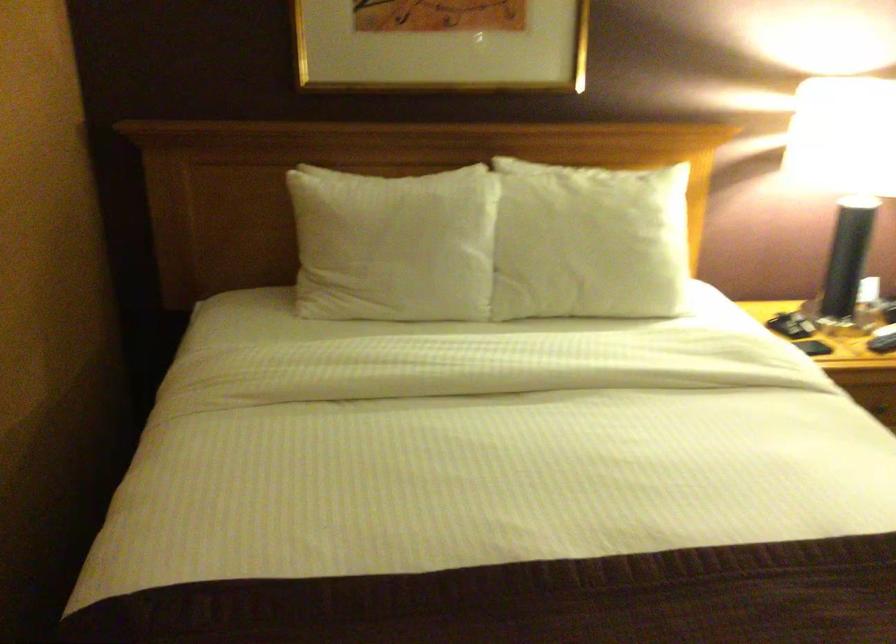
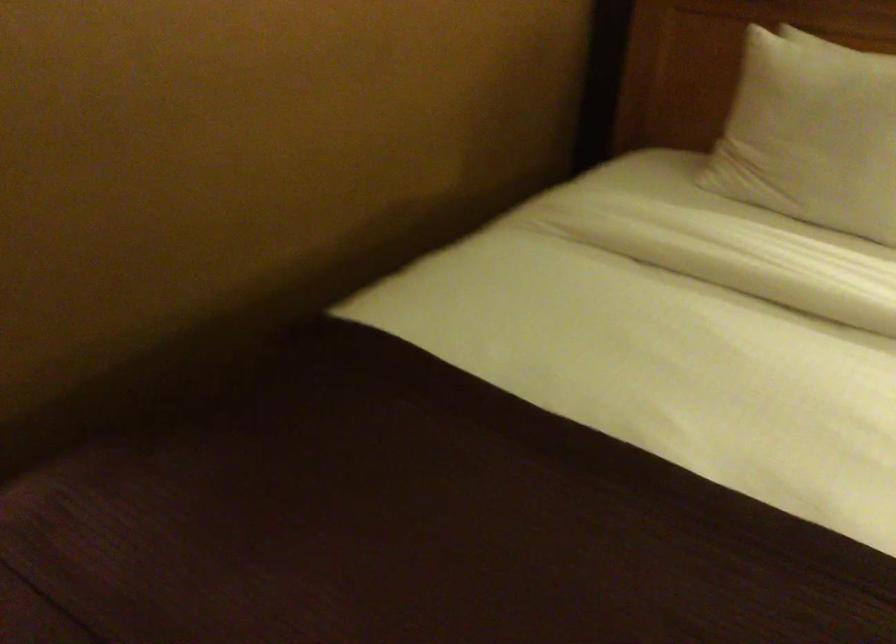
Question: The camera is either moving clockwise (left) or counter-clockwise (right) around the object. The first image is from the beginning of the video and the second image is from the end. Is the camera moving left or right when shooting the video?

Choices:
 (A) Left
 (B) Right

Answer: (B)